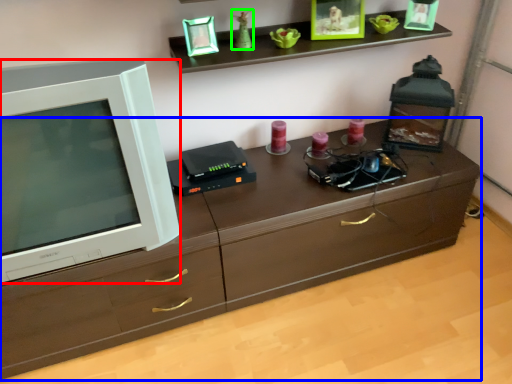
Question: Estimate the real-world distances between objects in this image. Which object is closer to television (highlighted by a red box), chest of drawers (highlighted by a blue box) or toy (highlighted by a green box)?

Choices:
 (A) chest of drawers
 (B) toy

Answer: (A)